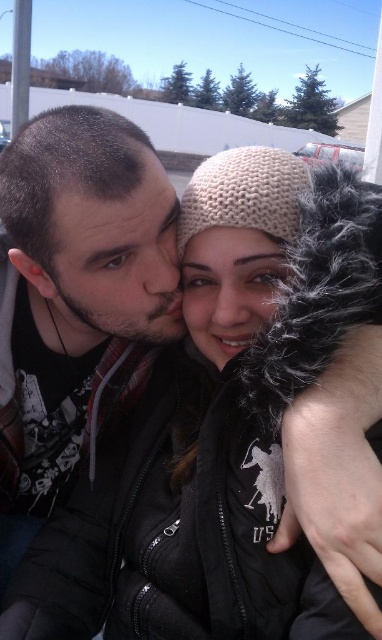
Question: Which point is closer to the camera?

Choices:
 (A) matte beige knit hat at center
 (B) dark brown hair at left

Answer: (A)

Question: Which object is the closest to the matte black jacket at left?

Choices:
 (A) dark brown hair at left
 (B) matte beige knit hat at center

Answer: (A)

Question: Does matte black jacket at left have a smaller size compared to matte beige knit hat at center?

Choices:
 (A) yes
 (B) no

Answer: (B)

Question: Which point is farther from the camera taking this photo?

Choices:
 (A) (43, 150)
 (B) (258, 316)

Answer: (B)

Question: Can you confirm if dark brown hair at left is smaller than matte beige knit hat at center?

Choices:
 (A) no
 (B) yes

Answer: (A)

Question: Can you confirm if matte black jacket at left is positioned above matte beige knit hat at center?

Choices:
 (A) no
 (B) yes

Answer: (A)